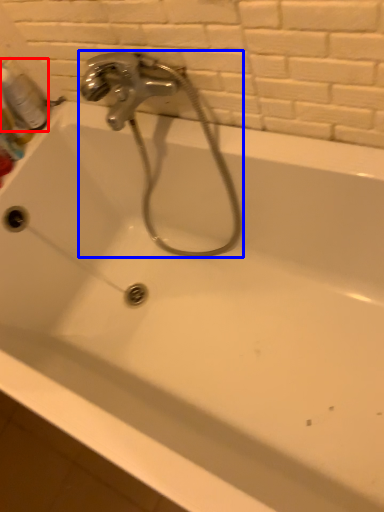
Question: Which object is closer to the camera taking this photo, mouthwash (highlighted by a red box) or plumbing fixture (highlighted by a blue box)?

Choices:
 (A) mouthwash
 (B) plumbing fixture

Answer: (B)